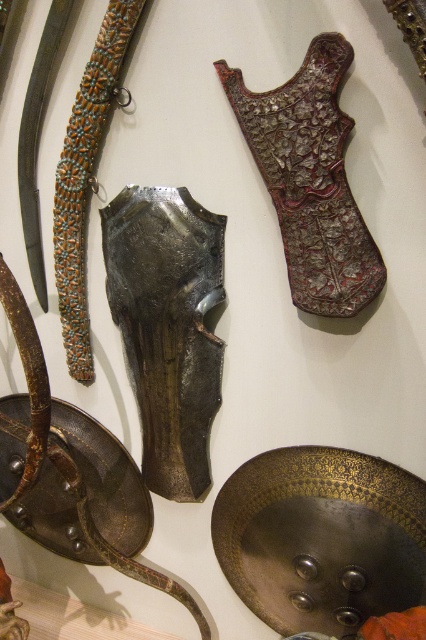
This screenshot has width=426, height=640. Describe the element at coordinates (310, 179) in the screenshot. I see `carved wood armor at center` at that location.

Between carved wood armor at center and polished metal sword at center, which one is positioned higher?

carved wood armor at center is above.

Locate an element on the screen. Image resolution: width=426 pixels, height=640 pixels. carved wood armor at center is located at coordinates (310, 179).

The image size is (426, 640). I want to click on carved wood armor at center, so click(x=310, y=179).

From the picture: Which is more to the left, metallic armor at center or carved wood armor at center?

metallic armor at center

Identify the location of metallic armor at center. The height and width of the screenshot is (640, 426). (167, 326).

Locate an element on the screen. Image resolution: width=426 pixels, height=640 pixels. metallic armor at center is located at coordinates (167, 326).

Between point (135, 337) and point (31, 74), which one is positioned behind?

The point (135, 337) is behind.

Where is `metallic armor at center`? metallic armor at center is located at coordinates (167, 326).